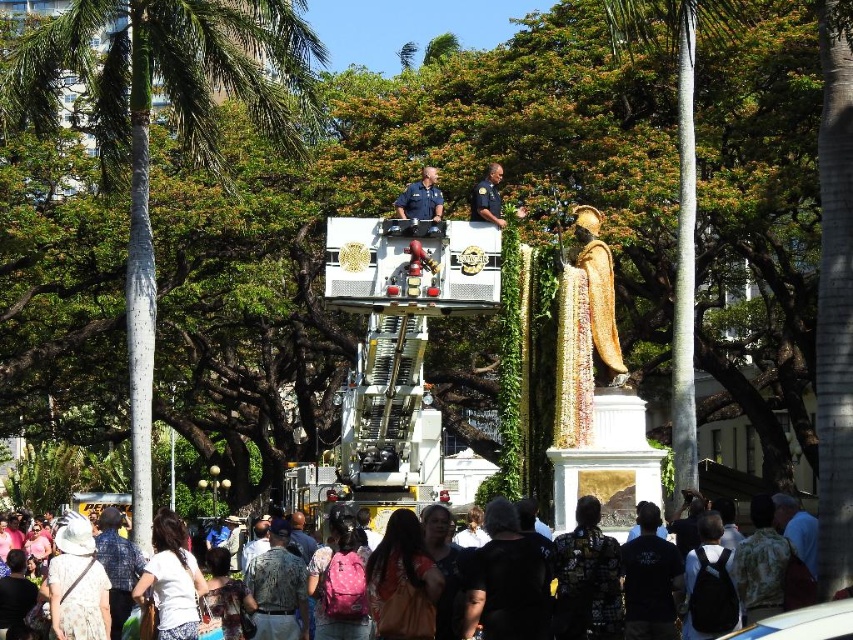
Can you confirm if dark clothing crowd at lower center is wider than gold textured robe at upper center?

Yes, dark clothing crowd at lower center is wider than gold textured robe at upper center.

From the picture: Is dark clothing crowd at lower center taller than gold textured robe at upper center?

Indeed, dark clothing crowd at lower center has a greater height compared to gold textured robe at upper center.

Which is in front, point (305, 536) or point (479, 189)?

Point (479, 189)

This screenshot has height=640, width=853. In order to click on dark clothing crowd at lower center in this screenshot , I will do `click(109, 564)`.

Does green leafy palm tree at center appear on the right side of denim shirt at lower left?

Indeed, green leafy palm tree at center is positioned on the right side of denim shirt at lower left.

Is green leafy palm tree at center below denim shirt at lower left?

No, green leafy palm tree at center is not below denim shirt at lower left.

Between point (675, 406) and point (111, 596), which one is positioned in front?

Point (111, 596) is more forward.

The height and width of the screenshot is (640, 853). I want to click on green leafy palm tree at center, so [677, 180].

Can you confirm if white metallic fire truck at center is taller than green leafy palm tree at center?

Incorrect, white metallic fire truck at center's height is not larger of green leafy palm tree at center's.

What do you see at coordinates (395, 353) in the screenshot? This screenshot has height=640, width=853. I see `white metallic fire truck at center` at bounding box center [395, 353].

This screenshot has height=640, width=853. What are the coordinates of `white metallic fire truck at center` in the screenshot? It's located at (395, 353).